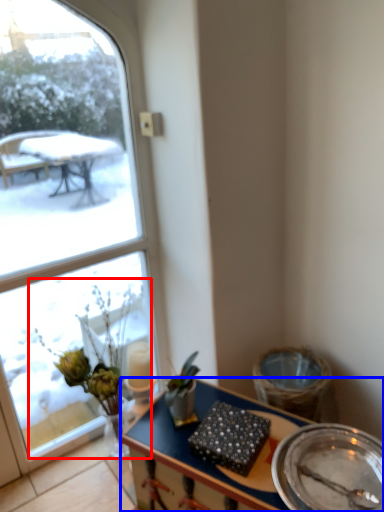
Question: Among these objects, which one is farthest to the camera, floral arrangement (highlighted by a red box) or desk (highlighted by a blue box)?

Choices:
 (A) floral arrangement
 (B) desk

Answer: (A)